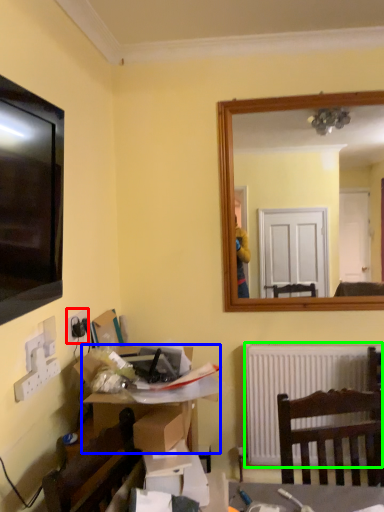
Question: Based on their relative distances, which object is farther from electric outlet (highlighted by a red box)? Choose from desk (highlighted by a blue box) and radiator (highlighted by a green box).

Choices:
 (A) desk
 (B) radiator

Answer: (B)